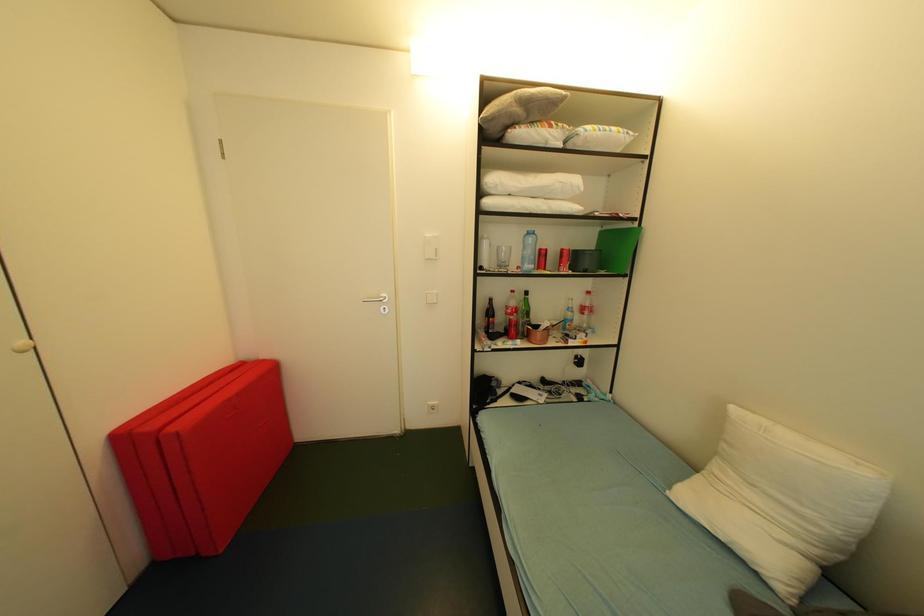
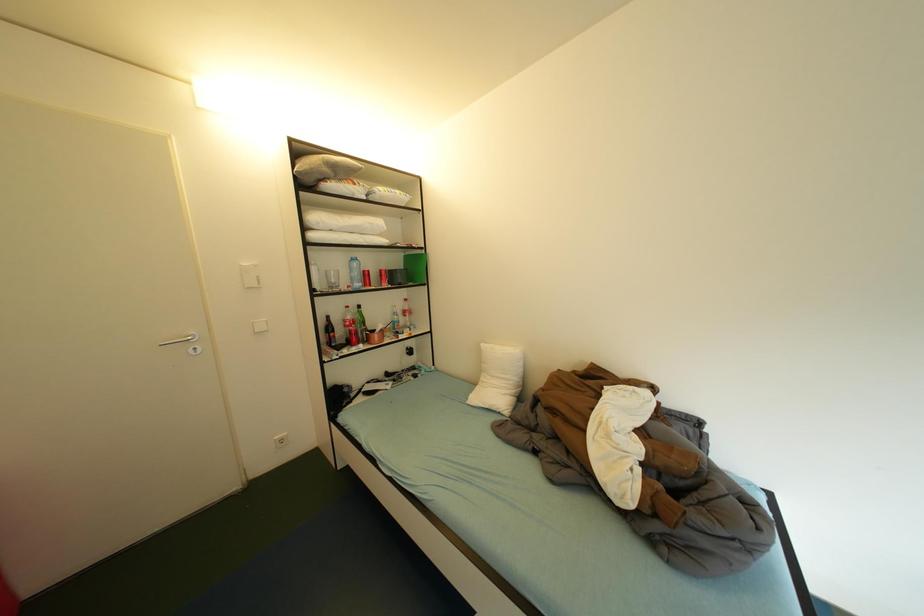
Question: The images are taken continuously from a first-person perspective. In which direction is your viewpoint rotating?

Choices:
 (A) Left
 (B) Right
 (C) Up
 (D) Down

Answer: (B)